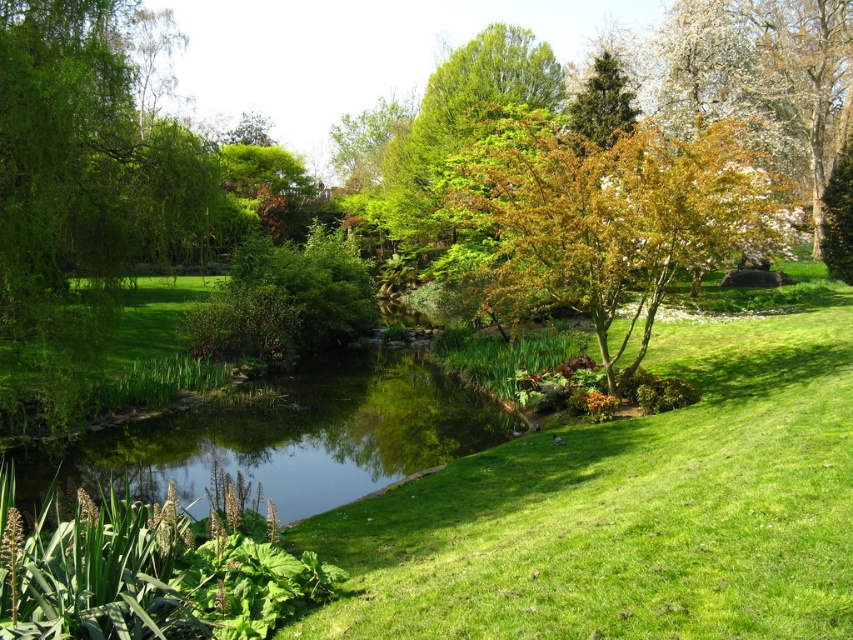
Consider the image. In the garden scene, you see the green smooth water at center and the green leafy tree at upper center. Which object takes up more space in the image?

The green leafy tree at upper center occupies more space than the green smooth water at center.